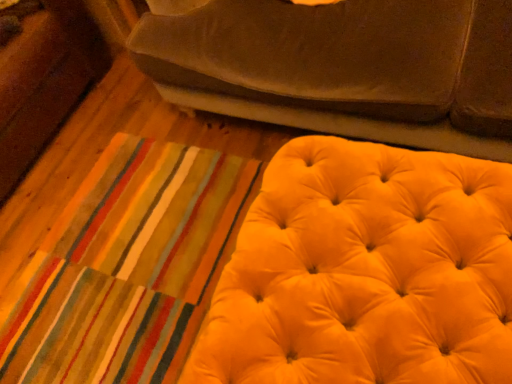
Question: Which direction should I rotate to look at suede-like brown studio couch at upper center?

Choices:
 (A) right
 (B) left

Answer: (A)

Question: Is yellow velvet ottoman at lower right in contact with suede-like brown studio couch at upper center?

Choices:
 (A) no
 (B) yes

Answer: (A)

Question: From a real-world perspective, is yellow velvet ottoman at lower right physically above suede-like brown studio couch at upper center?

Choices:
 (A) no
 (B) yes

Answer: (A)

Question: Is yellow velvet ottoman at lower right positioned with its back to suede-like brown studio couch at upper center?

Choices:
 (A) yes
 (B) no

Answer: (B)

Question: Is yellow velvet ottoman at lower right in front of suede-like brown studio couch at upper center?

Choices:
 (A) no
 (B) yes

Answer: (B)

Question: Can you confirm if yellow velvet ottoman at lower right is thinner than suede-like brown studio couch at upper center?

Choices:
 (A) yes
 (B) no

Answer: (A)

Question: Considering the relative sizes of yellow velvet ottoman at lower right and suede-like brown studio couch at upper center in the image provided, is yellow velvet ottoman at lower right bigger than suede-like brown studio couch at upper center?

Choices:
 (A) yes
 (B) no

Answer: (B)

Question: Is the depth of suede-like brown studio couch at upper center less than that of yellow velvet ottoman at lower right?

Choices:
 (A) no
 (B) yes

Answer: (A)

Question: Is yellow velvet ottoman at lower right at the back of suede-like brown studio couch at upper center?

Choices:
 (A) no
 (B) yes

Answer: (A)

Question: From a real-world perspective, is suede-like brown studio couch at upper center below yellow velvet ottoman at lower right?

Choices:
 (A) yes
 (B) no

Answer: (B)

Question: From the image's perspective, is suede-like brown studio couch at upper center on top of yellow velvet ottoman at lower right?

Choices:
 (A) yes
 (B) no

Answer: (A)

Question: Is suede-like brown studio couch at upper center to the right of yellow velvet ottoman at lower right from the viewer's perspective?

Choices:
 (A) no
 (B) yes

Answer: (B)

Question: Is suede-like brown studio couch at upper center touching yellow velvet ottoman at lower right?

Choices:
 (A) yes
 (B) no

Answer: (B)

Question: In terms of size, does yellow velvet ottoman at lower right appear bigger or smaller than suede-like brown studio couch at upper center?

Choices:
 (A) big
 (B) small

Answer: (B)